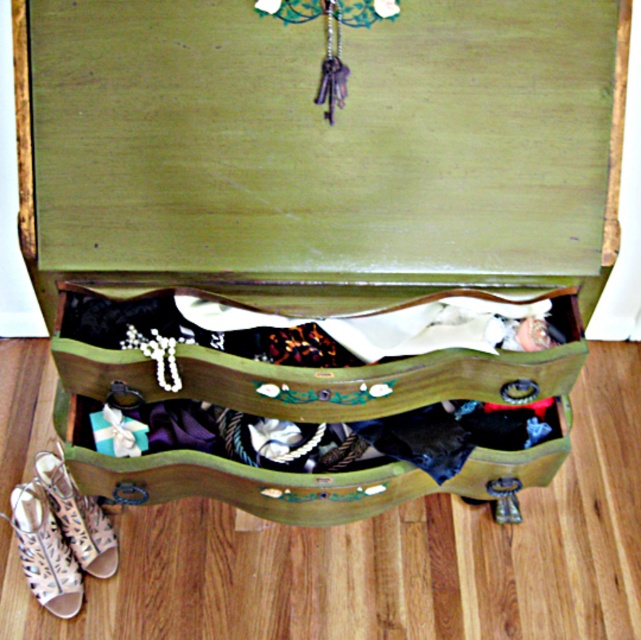
You are standing in front of the vintage wooden chest of drawers. There is a point at coordinates (x=310, y=416). What object is located at this point?

The green painted wood drawer at center is located at point (x=310, y=416).